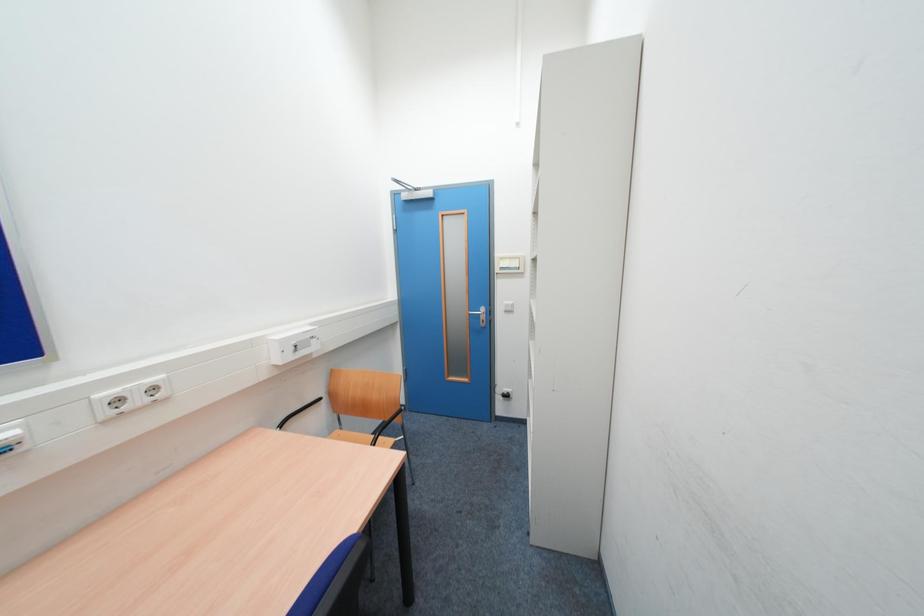
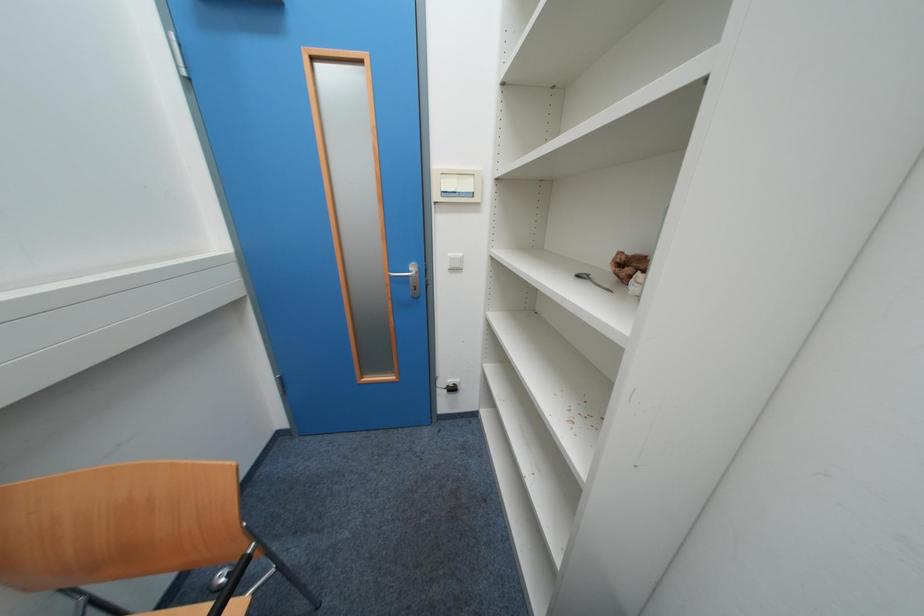
Question: Which direction would the cameraman need to move to produce the second image? Reply with the corresponding letter.

Choices:
 (A) Left
 (B) Right
 (C) Forward
 (D) Backward

Answer: (C)